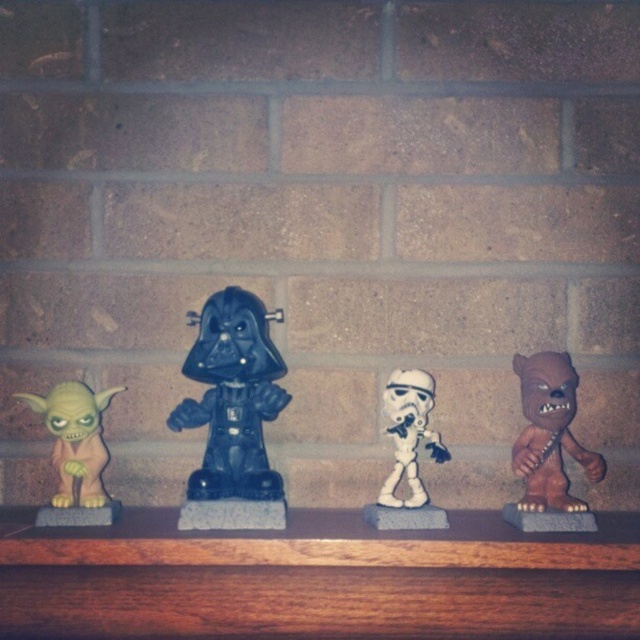
Based on the photo, you are a collector who wants to place a new 3.5 inch wide Star Wars figure between the brown wood shelf at center and the matte black figure at center. Can the new figure fit in the space between them?

The brown wood shelf at center is 3.66 inches away from the matte black figure at center. Since the new figure is 3.5 inches wide, it can fit in the space between them as the distance is slightly larger than the figure.

Based on the scene description, can you determine the distance of the point marked as point (212, 593) from the camera?

The point (212, 593) is 3.94 feet away from the camera.